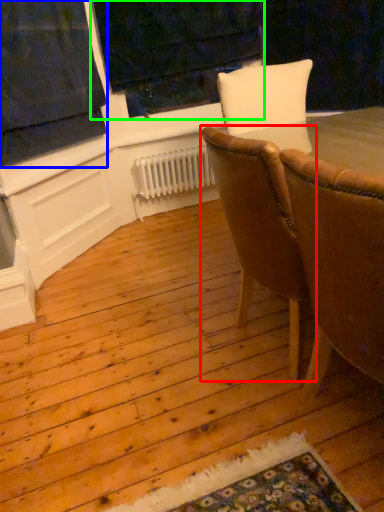
Question: Estimate the real-world distances between objects in this image. Which object is farther from chair (highlighted by a red box), curtain (highlighted by a blue box) or window frame (highlighted by a green box)?

Choices:
 (A) curtain
 (B) window frame

Answer: (B)